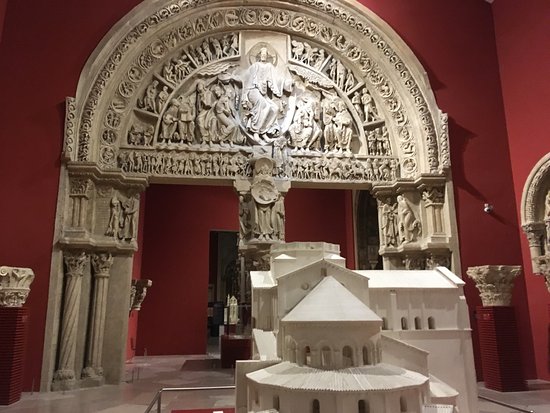
This screenshot has width=550, height=413. I want to click on stone ornate bowl, so click(15, 284), click(507, 281).